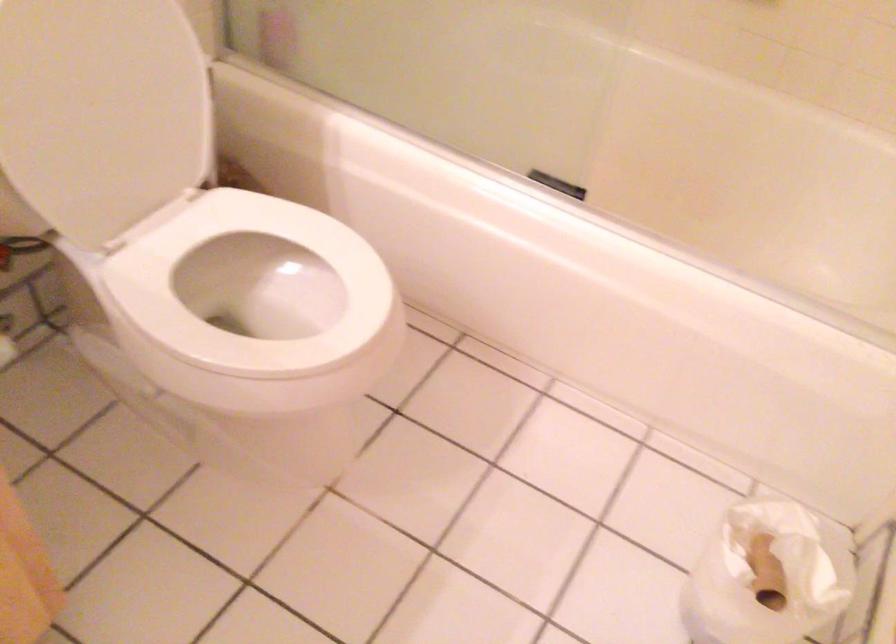
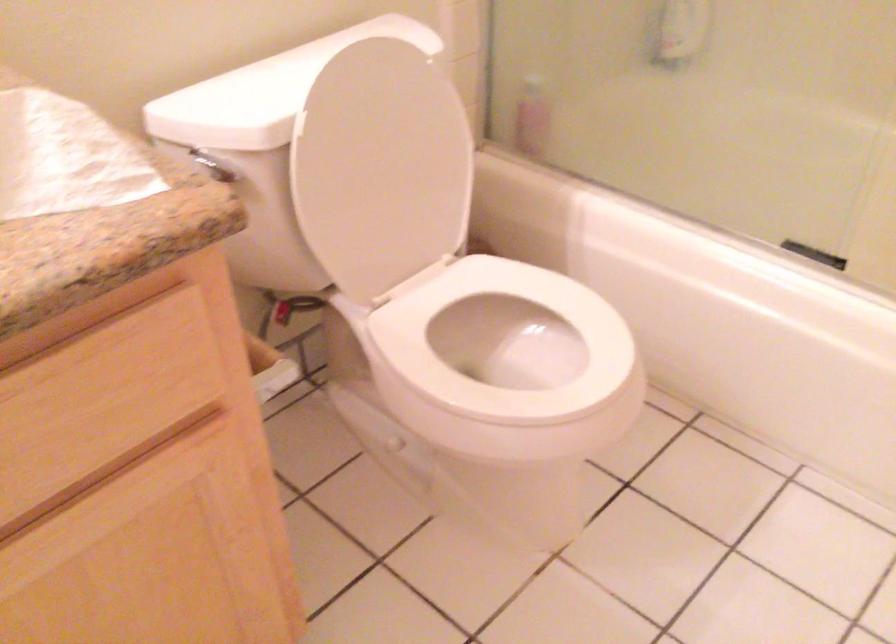
What movement of the cameraman would produce the second image?

The cameraman walked toward left, backward.